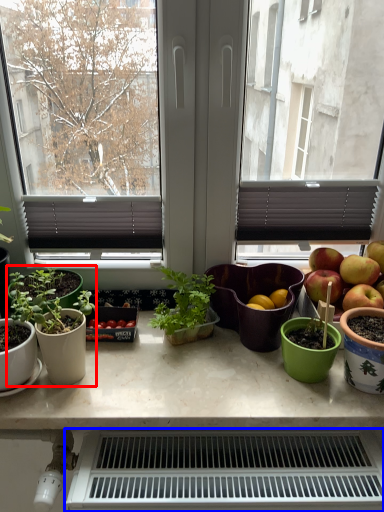
Question: Among these objects, which one is nearest to the camera, houseplant (highlighted by a red box) or appliance (highlighted by a blue box)?

Choices:
 (A) houseplant
 (B) appliance

Answer: (B)